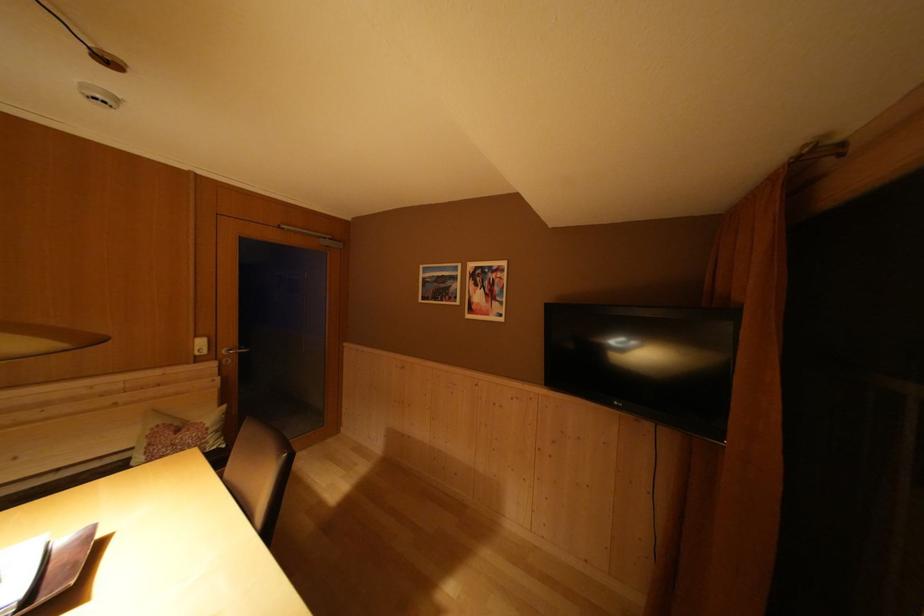
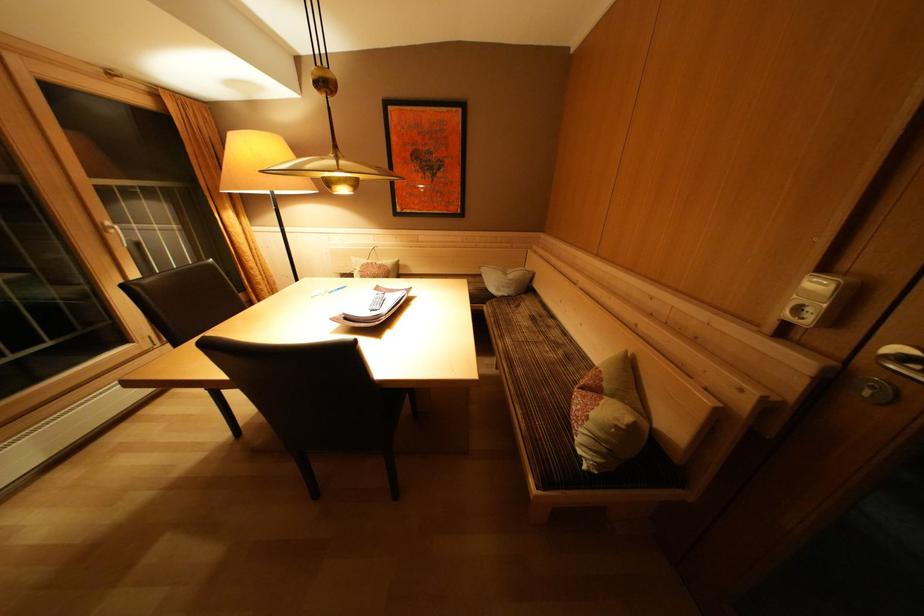
The point at (214, 430) is marked in the first image. Where is the corresponding point in the second image?

(600, 419)